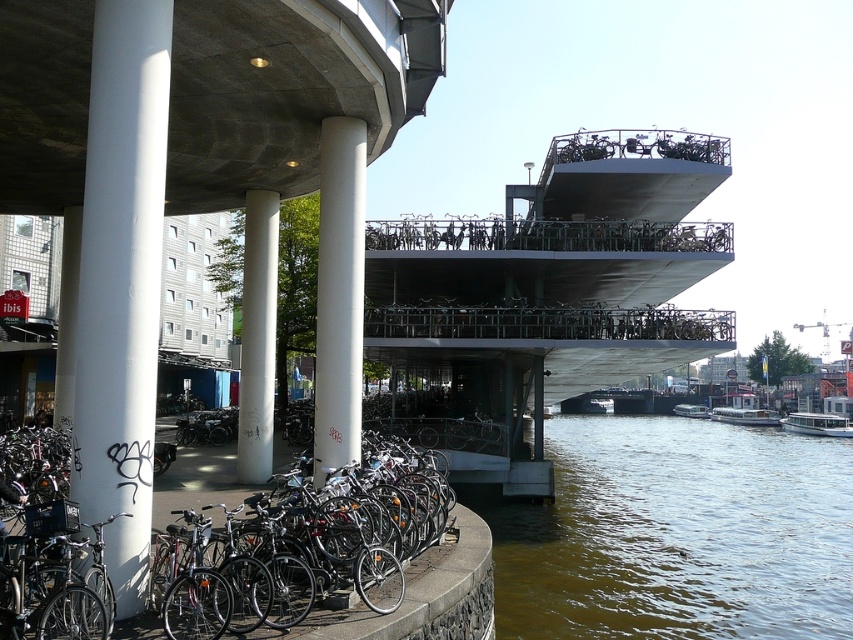
Question: Is concrete at upper center positioned at the back of white concrete column at center?

Choices:
 (A) no
 (B) yes

Answer: (A)

Question: Estimate the real-world distances between objects in this image. Which object is closer to the greenish water at lower right?

Choices:
 (A) concrete at upper center
 (B) white smooth concrete pillar at center
 (C) shiny metallic bicycle at lower left

Answer: (A)

Question: Which object is positioned farthest from the concrete at upper center?

Choices:
 (A) white smooth concrete pillar at left
 (B) white concrete column at center
 (C) white smooth concrete pillar at center

Answer: (A)

Question: Is concrete at upper center positioned at the back of white smooth concrete pillar at center?

Choices:
 (A) yes
 (B) no

Answer: (B)

Question: In this image, where is concrete at upper center located relative to white concrete column at center?

Choices:
 (A) below
 (B) above

Answer: (B)

Question: Among these objects, which one is nearest to the camera?

Choices:
 (A) greenish water at lower right
 (B) shiny metallic bicycle at lower left

Answer: (B)